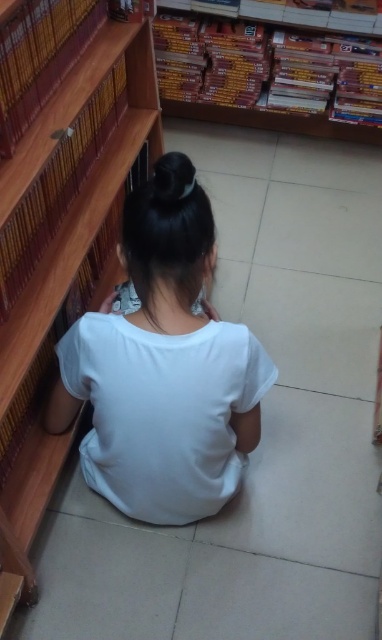
Which is above, white cotton shirt at center or wooden bookshelf at left?

wooden bookshelf at left is higher up.

Consider the image. Is the position of white cotton shirt at center less distant than that of wooden bookshelf at left?

No, white cotton shirt at center is further to the viewer.

The height and width of the screenshot is (640, 382). What are the coordinates of `white cotton shirt at center` in the screenshot? It's located at (163, 365).

Between wooden bookshelf at left and wooden bookshelf at upper center, which one appears on the right side from the viewer's perspective?

Positioned to the right is wooden bookshelf at upper center.

Does wooden bookshelf at left come behind wooden bookshelf at upper center?

No.

Where is `wooden bookshelf at left`? The height and width of the screenshot is (640, 382). wooden bookshelf at left is located at coordinates (74, 202).

Can you confirm if white cotton shirt at center is positioned below wooden bookshelf at upper center?

Yes, white cotton shirt at center is below wooden bookshelf at upper center.

Does white cotton shirt at center have a lesser height compared to wooden bookshelf at upper center?

In fact, white cotton shirt at center may be taller than wooden bookshelf at upper center.

What are the coordinates of `white cotton shirt at center` in the screenshot? It's located at (163, 365).

Locate an element on the screen. This screenshot has width=382, height=640. white cotton shirt at center is located at coordinates (163, 365).